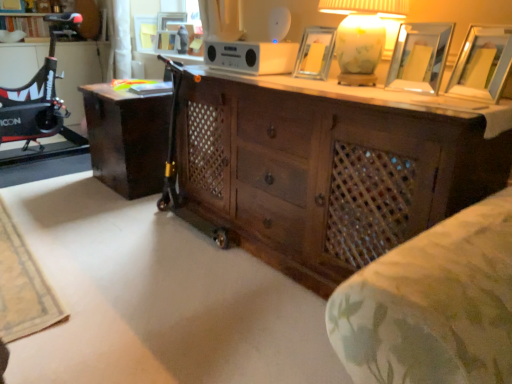
What are the coordinates of `vacant space underneath matte glass table lamp at upper right (from a real-world perspective)` in the screenshot? It's located at (338, 83).